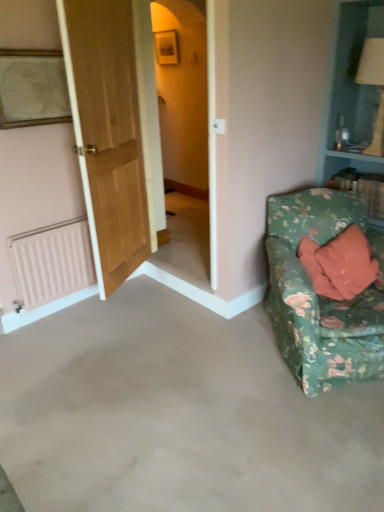
Question: Considering the positions of gray carpet at lower right and floral fabric couch at lower right in the image, is gray carpet at lower right wider or thinner than floral fabric couch at lower right?

Choices:
 (A) thin
 (B) wide

Answer: (B)

Question: From the image's perspective, is gray carpet at lower right above or below floral fabric couch at lower right?

Choices:
 (A) above
 (B) below

Answer: (B)

Question: Which is farther from the pink matte radiator at lower left?

Choices:
 (A) gray carpet at lower right
 (B) white fabric table lamp at upper right
 (C) wooden framed portrait at upper left
 (D) wooden door at left
 (E) floral fabric couch at lower right

Answer: (B)

Question: Estimate the real-world distances between objects in this image. Which object is farther from the white fabric table lamp at upper right?

Choices:
 (A) pink matte radiator at lower left
 (B) wooden framed portrait at upper left
 (C) wooden door at left
 (D) floral fabric couch at lower right
 (E) gray carpet at lower right

Answer: (A)